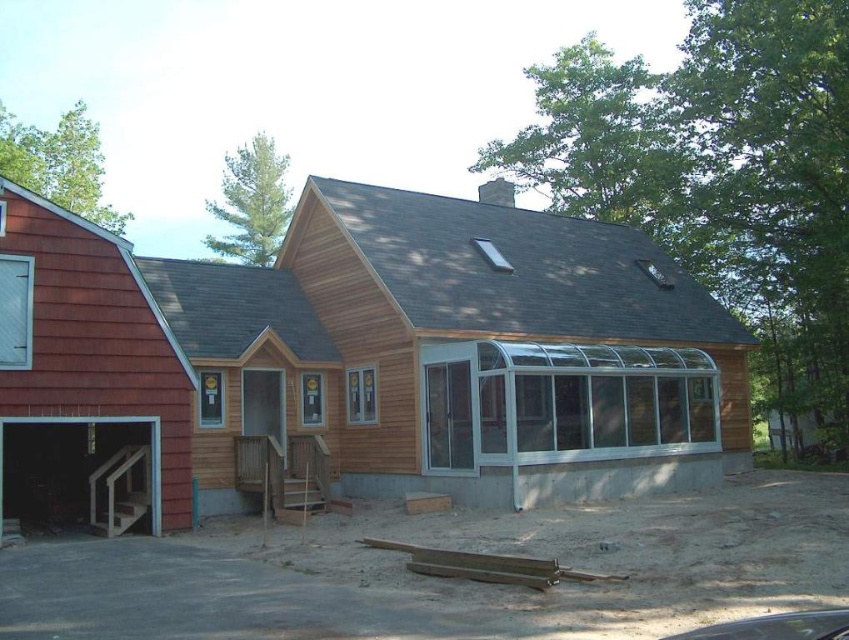
How much distance is there between wooden barn at center and matte wood stairs at lower left?

They are 24.01 feet apart.

Does wooden barn at center appear on the right side of matte wood stairs at lower left?

Yes, wooden barn at center is to the right of matte wood stairs at lower left.

Between point (381, 253) and point (145, 419), which one is positioned behind?

The point (381, 253) is behind.

Locate an element on the screen. wooden barn at center is located at coordinates (358, 362).